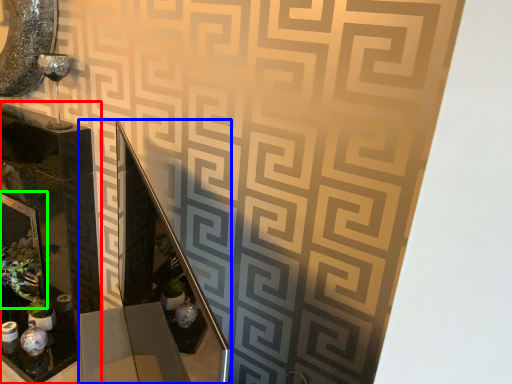
Question: Considering the real-world distances, which object is closest to glass box (highlighted by a red box)? vanity (highlighted by a blue box) or picture frame (highlighted by a green box).

Choices:
 (A) vanity
 (B) picture frame

Answer: (B)